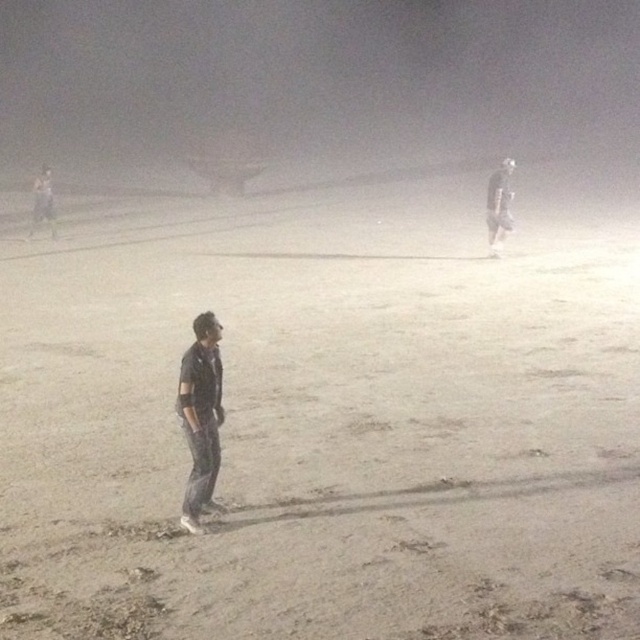
Question: Can you confirm if dark blue shirt at center is positioned below dark gray jeans at upper left?

Choices:
 (A) no
 (B) yes

Answer: (B)

Question: Which object is the closest to the white matte figure at upper right?

Choices:
 (A) gray sandy field at center
 (B) dark blue shirt at center

Answer: (A)

Question: Which of the following is the farthest from the observer?

Choices:
 (A) gray sandy field at center
 (B) dark blue shirt at center
 (C) dark gray jeans at upper left

Answer: (C)

Question: Does dark blue shirt at center appear over white matte figure at upper right?

Choices:
 (A) yes
 (B) no

Answer: (B)

Question: Which object appears closest to the camera in this image?

Choices:
 (A) gray sandy field at center
 (B) dark gray jeans at upper left

Answer: (A)

Question: Is gray sandy field at center smaller than white matte figure at upper right?

Choices:
 (A) yes
 (B) no

Answer: (B)